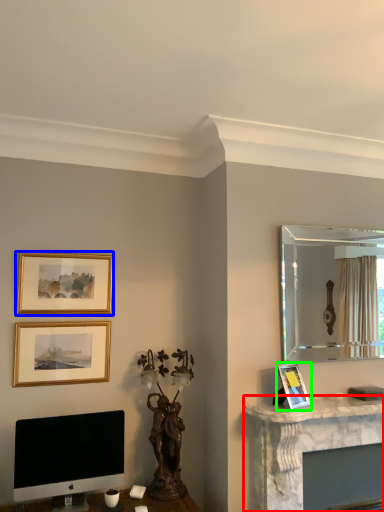
Question: Which object is the farthest from computer desk (highlighted by a red box)? Choose among these: picture frame (highlighted by a blue box) or picture frame (highlighted by a green box).

Choices:
 (A) picture frame
 (B) picture frame

Answer: (A)